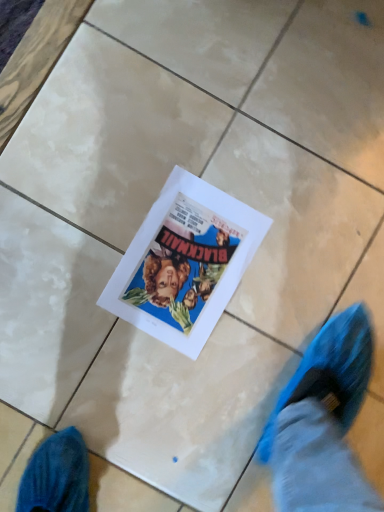
Where is `blank area to the left of white paper at center`? The width and height of the screenshot is (384, 512). blank area to the left of white paper at center is located at coordinates (94, 186).